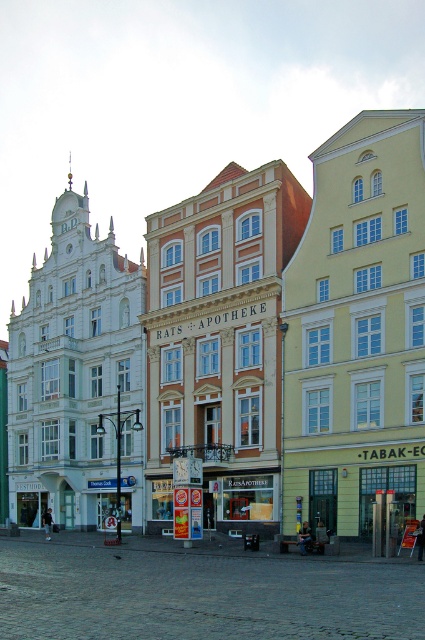
Does matte white building at center have a smaller size compared to matte glass storefront at center?

Actually, matte white building at center might be larger than matte glass storefront at center.

Which of these two, matte white building at center or matte glass storefront at center, stands shorter?

matte glass storefront at center is shorter.

Is point (61, 428) farther from viewer compared to point (227, 493)?

Yes, it is.

I want to click on matte white building at center, so click(235, 340).